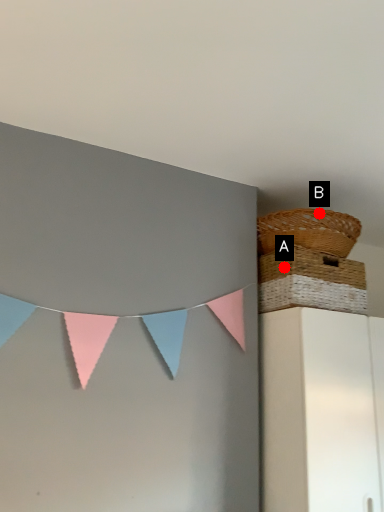
Question: Two points are circled on the image, labeled by A and B beside each circle. Which point appears closest to the camera in this image?

Choices:
 (A) A is closer
 (B) B is closer

Answer: (A)